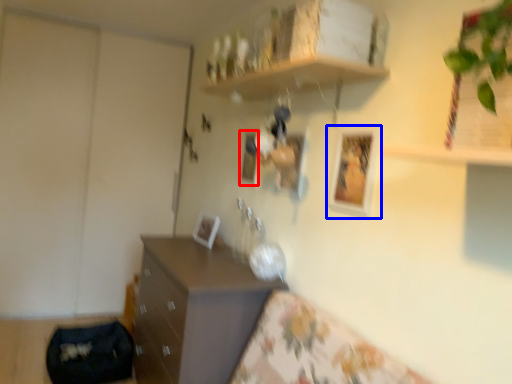
Question: Which point is closer to the camera, picture frame (highlighted by a red box) or picture frame (highlighted by a blue box)?

Choices:
 (A) picture frame
 (B) picture frame

Answer: (B)